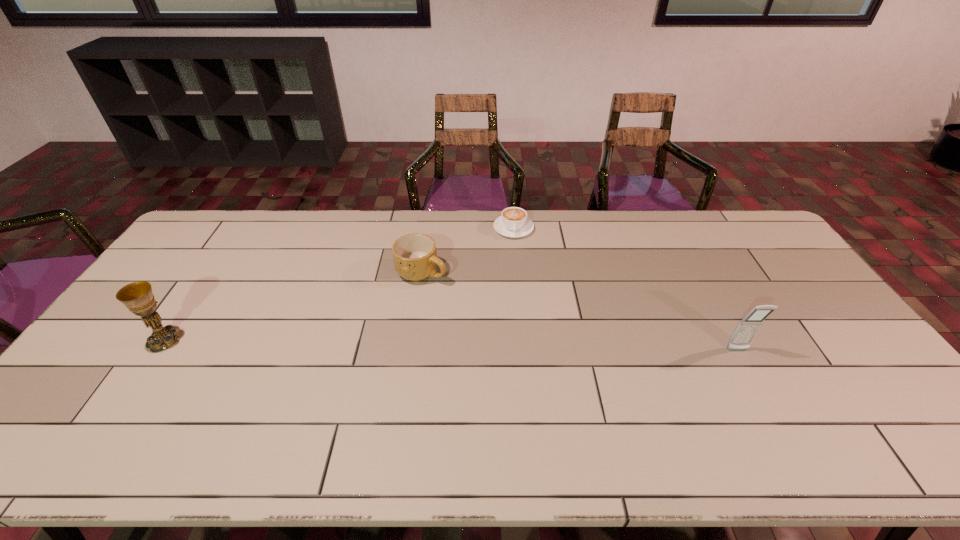
In the image, there is a desktop. Identify the location of vacant space at the far right corner. (725, 221).

The image size is (960, 540). Identify the location of free space between the chalice and the rightmost object. pyautogui.click(x=451, y=345).

Locate an element on the screen. The width and height of the screenshot is (960, 540). free space that is in between the shortest object and the chalice is located at coordinates (339, 284).

Locate an element on the screen. vacant space that is in between the third object from right to left and the rightmost object is located at coordinates (580, 311).

This screenshot has height=540, width=960. Identify the location of empty space that is in between the rightmost object and the mug. (580, 311).

The width and height of the screenshot is (960, 540). I want to click on vacant region between the chalice and the rightmost object, so click(451, 345).

Where is `vacant region between the farthest object and the second object from left to right`? This screenshot has height=540, width=960. vacant region between the farthest object and the second object from left to right is located at coordinates (468, 250).

The image size is (960, 540). Identify the location of free spot between the cappuccino and the second farthest object. (468, 250).

At what (x,y) coordinates should I click in order to perform the action: click on empty space that is in between the leftmost object and the rightmost object. Please return your answer as a coordinate pair (x, y). Looking at the image, I should click on (451, 345).

Identify the location of free point between the leftmost object and the second object from left to right. (294, 306).